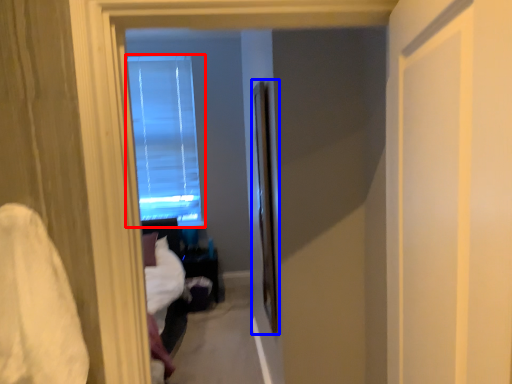
Question: Which object appears closest to the camera in this image, window (highlighted by a red box) or screen door (highlighted by a blue box)?

Choices:
 (A) window
 (B) screen door

Answer: (B)